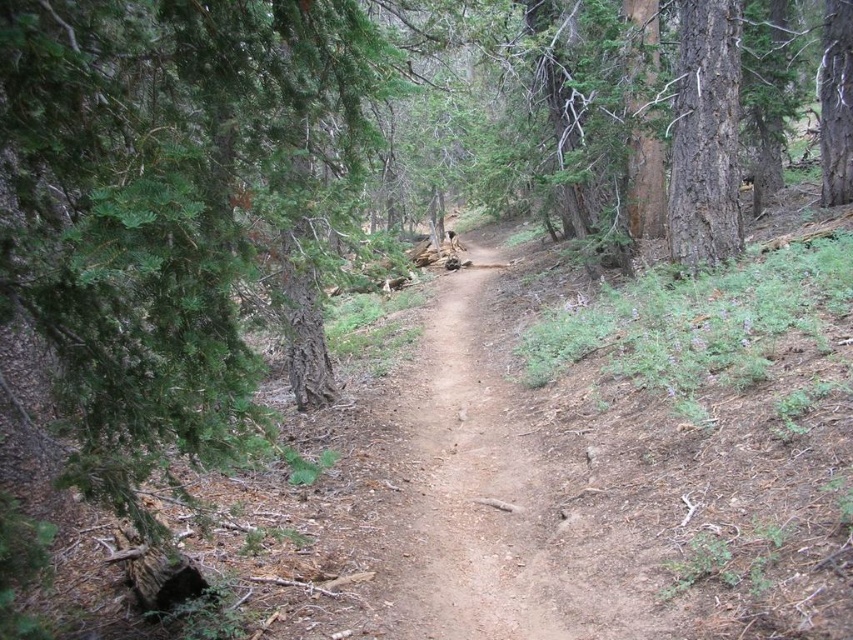
You are a hiker navigating a narrow dirt trail through a dense forest. You come across a point marked at coordinates (463, 484). Based on the scene description, what does this point likely represent?

The point at coordinates (463, 484) indicates the dirt path at center, so it likely represents the central area of the trail where the hiker should walk to stay on the path.

You are a hiker trying to cross the dirt path at center. There is a smooth brown tree trunk at right nearby. Which one is higher from the ground?

The smooth brown tree trunk at right is higher than the dirt path at center.

You are a hiker carrying a heavy backpack and need to cross the dirt path at center. There is a smooth brown tree trunk at right nearby. Which direction should you head to reach the tree trunk from the path?

To reach the smooth brown tree trunk at right from the dirt path at center, you should head to the right since the dirt path at center is located to the left of the tree trunk.